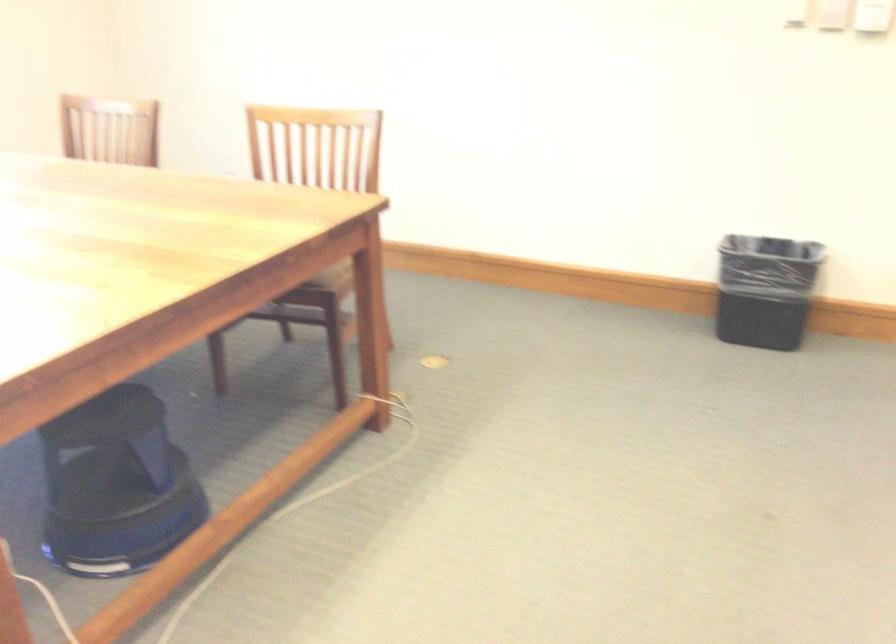
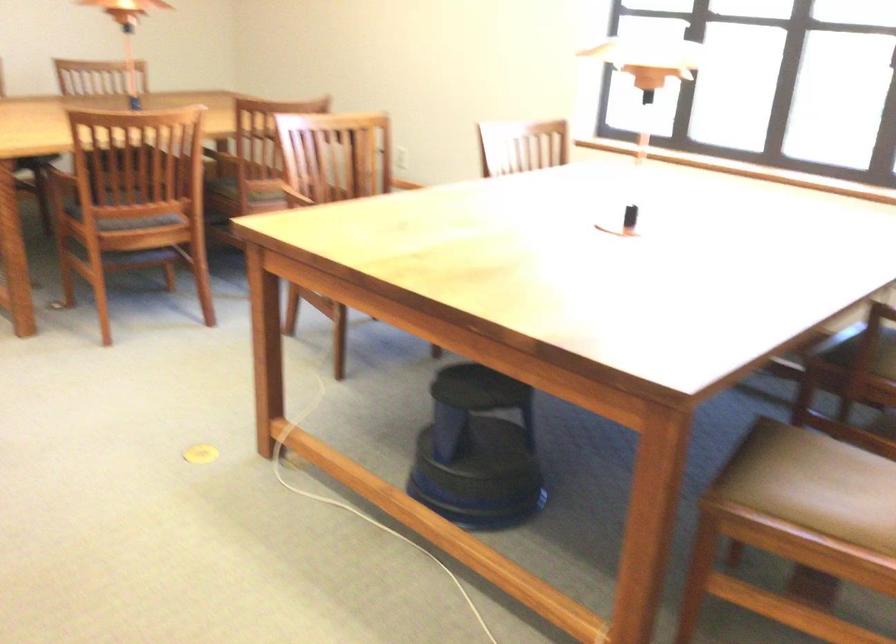
Find the pixel in the second image that matches point 124,471 in the first image.

(478, 451)